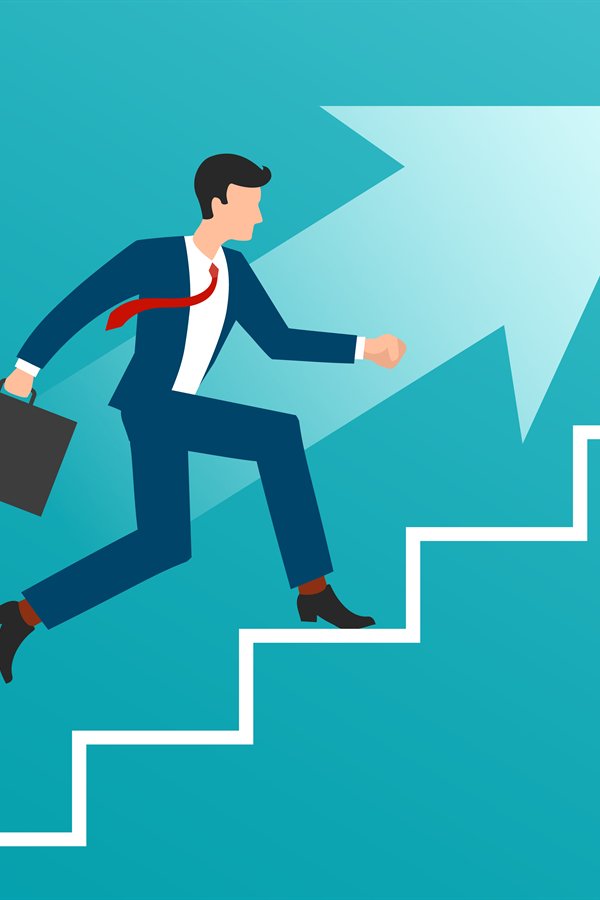
I want to click on stairs, so [x=594, y=445], [x=427, y=549], [x=263, y=651], [x=97, y=753], [x=6, y=851].